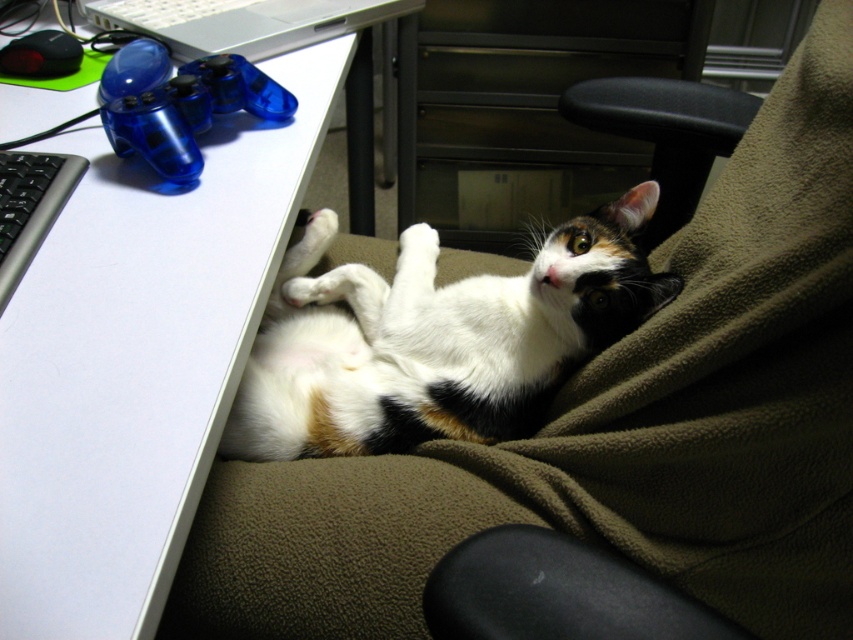
Is white plastic computer desk at lower left positioned in front of calico fur cat at lower right?

Yes, it is.

Can you confirm if white plastic computer desk at lower left is shorter than calico fur cat at lower right?

No, white plastic computer desk at lower left is not shorter than calico fur cat at lower right.

Locate an element on the screen. This screenshot has width=853, height=640. white plastic computer desk at lower left is located at coordinates (138, 358).

Image resolution: width=853 pixels, height=640 pixels. What do you see at coordinates (434, 339) in the screenshot?
I see `calico fur cat at lower right` at bounding box center [434, 339].

Which of these two, calico fur cat at lower right or silver metallic laptop at upper left, stands taller?

calico fur cat at lower right

Who is more forward, (434, 344) or (212, 0)?

Positioned in front is point (434, 344).

I want to click on calico fur cat at lower right, so click(434, 339).

Which of these two, white plastic computer desk at lower left or silver metallic laptop at upper left, stands shorter?

silver metallic laptop at upper left

Does white plastic computer desk at lower left have a greater width compared to silver metallic laptop at upper left?

Correct, the width of white plastic computer desk at lower left exceeds that of silver metallic laptop at upper left.

Does point (222, 204) lie in front of point (308, 35)?

Yes, it is.

Find the location of a particular element. white plastic computer desk at lower left is located at coordinates (138, 358).